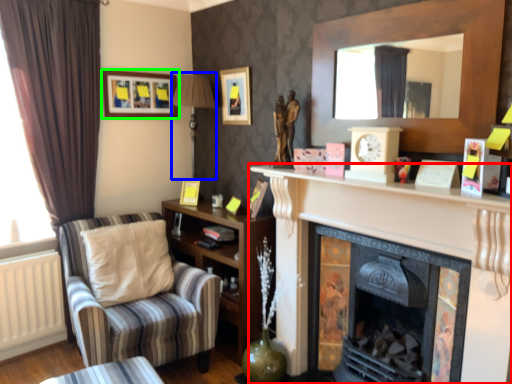
Question: Considering the real-world distances, which object is closest to fireplace (highlighted by a red box)? lamp (highlighted by a blue box) or picture frame (highlighted by a green box).

Choices:
 (A) lamp
 (B) picture frame

Answer: (A)